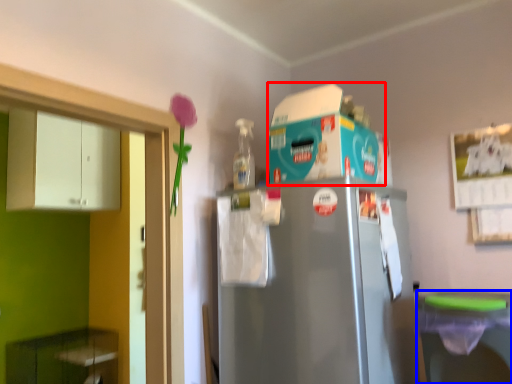
Question: Which object appears farthest to the camera in this image, appliance (highlighted by a red box) or dish washer (highlighted by a blue box)?

Choices:
 (A) appliance
 (B) dish washer

Answer: (A)